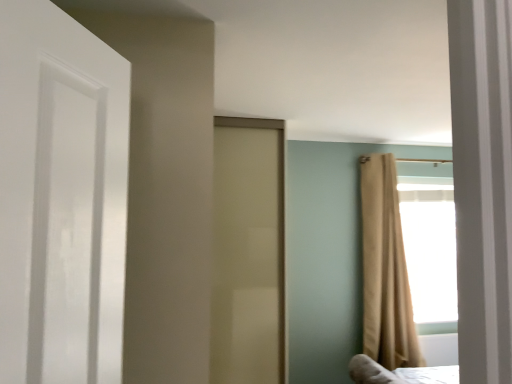
Question: Looking at their shapes, would you say beige fabric curtain at right is wider or thinner than matte beige door at center?

Choices:
 (A) thin
 (B) wide

Answer: (A)

Question: Is point (368, 223) closer or farther from the camera than point (219, 370)?

Choices:
 (A) closer
 (B) farther

Answer: (B)

Question: Based on their sizes in the image, would you say beige fabric curtain at right is bigger or smaller than matte beige door at center?

Choices:
 (A) big
 (B) small

Answer: (B)

Question: Looking at the image, does matte beige door at center seem bigger or smaller compared to beige fabric curtain at right?

Choices:
 (A) big
 (B) small

Answer: (A)

Question: In the image, is matte beige door at center positioned in front of or behind beige fabric curtain at right?

Choices:
 (A) behind
 (B) front

Answer: (B)

Question: Considering the positions of matte beige door at center and beige fabric curtain at right in the image, is matte beige door at center wider or thinner than beige fabric curtain at right?

Choices:
 (A) wide
 (B) thin

Answer: (A)

Question: Based on their positions, is matte beige door at center located to the left or right of beige fabric curtain at right?

Choices:
 (A) right
 (B) left

Answer: (B)